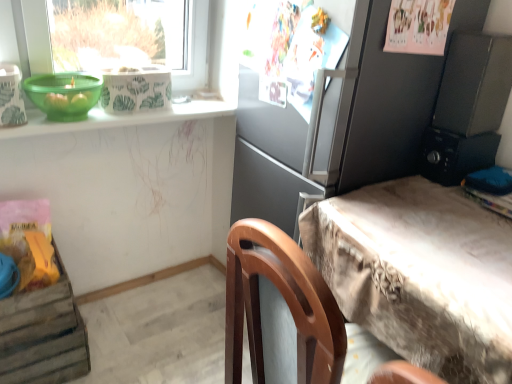
Question: Would you say matte gray refrigerator at center is inside or outside black plastic radio at upper right?

Choices:
 (A) inside
 (B) outside

Answer: (B)

Question: Relative to black plastic radio at upper right, is matte gray refrigerator at center in front or behind?

Choices:
 (A) front
 (B) behind

Answer: (A)

Question: Considering the real-world distances, which object is farthest from the wooden crate at lower left?

Choices:
 (A) black plastic radio at upper right
 (B) green plastic bowl at upper left
 (C) green plastic bowl at upper left
 (D) matte gray refrigerator at center
 (E) textured beige desk at right

Answer: (A)

Question: Which object is the farthest from the wooden crate at lower left?

Choices:
 (A) green plastic bowl at upper left
 (B) black plastic radio at upper right
 (C) matte gray refrigerator at center
 (D) textured beige desk at right
 (E) green plastic bowl at upper left

Answer: (B)